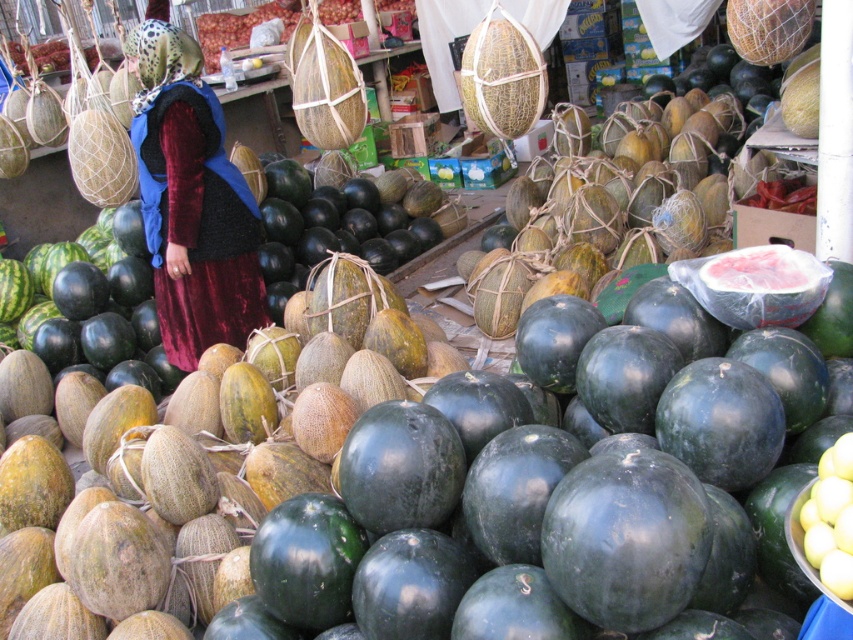
At what (x,y) coordinates should I click in order to perform the action: click on green matte watermelon at center. Please return your answer as a coordinate pair (x, y). This screenshot has height=640, width=853. Looking at the image, I should click on (549, 499).

Is green matte watermelon at center smaller than velvet dress at center?

Actually, green matte watermelon at center might be larger than velvet dress at center.

Find the location of a particular element. green matte watermelon at center is located at coordinates (549, 499).

Where is `green matte watermelon at center`? This screenshot has height=640, width=853. green matte watermelon at center is located at coordinates (549, 499).